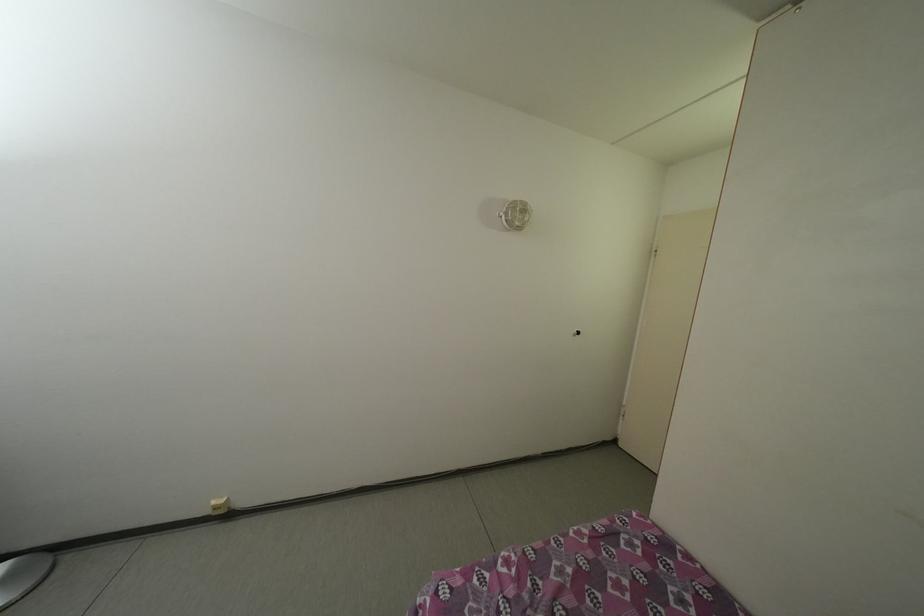
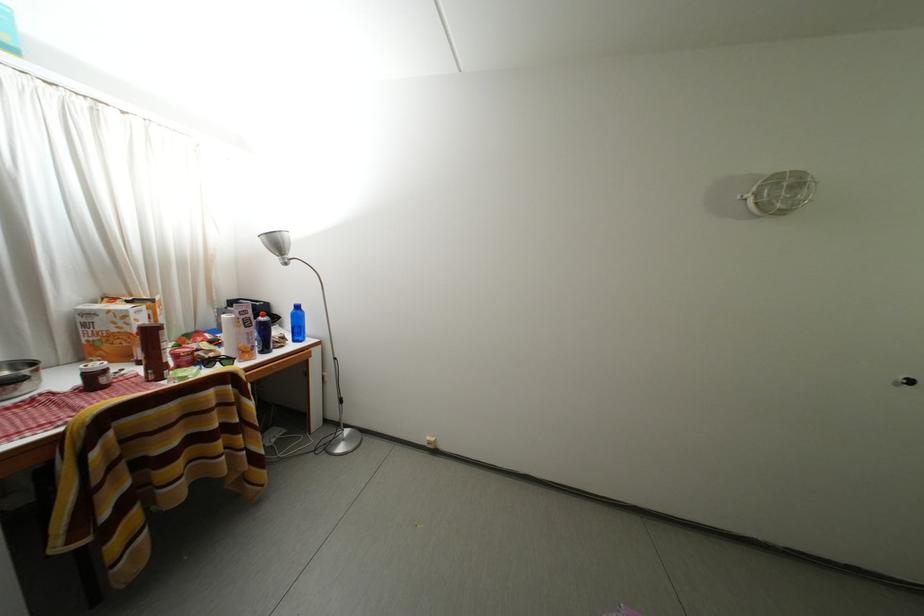
Question: How did the camera likely rotate?

Choices:
 (A) Left
 (B) Right
 (C) Up
 (D) Down

Answer: (A)